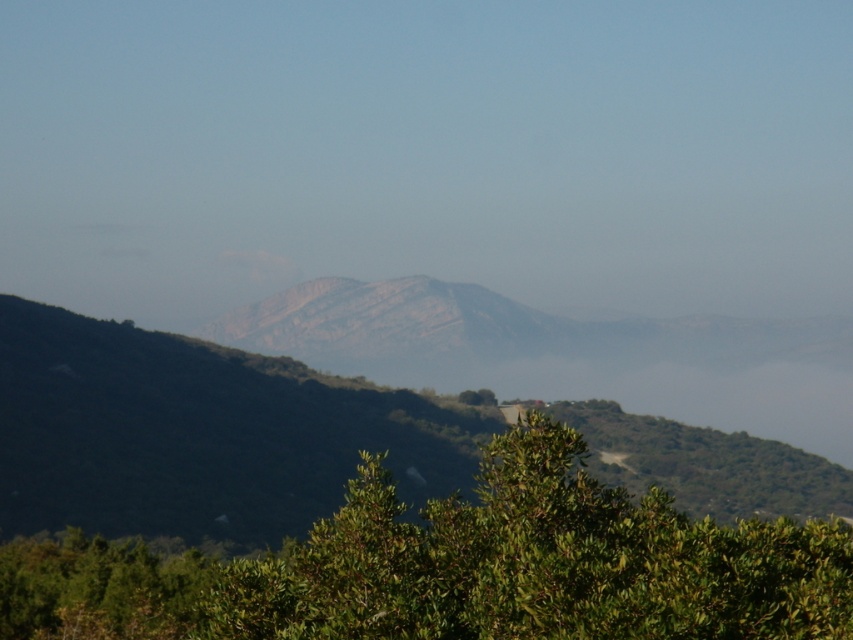
You are standing at the point with coordinates point (360, 632) and want to walk towards the point with coordinates point (132, 506). Given the landscape described, will you have to climb uphill or downhill to reach your destination?

Since point (360, 632) is in front of point (132, 506), it means you are already closer to the foreground. To reach the point behind it, you would need to move towards the background, which in the scene is elevated with hills and mountains. Therefore, you would have to climb uphill to reach point (132, 506).

You are an outdoor photographer planning to capture a landscape shot that includes both the green leafy tree at center and the rugged stone mountain at center. Based on their relative sizes, which object should you position closer to the center of your frame to ensure both are adequately framed without one overpowering the other?

The green leafy tree at center has a lesser width compared to the rugged stone mountain at center. To balance the composition, position the green leafy tree at center slightly closer to the center of the frame since it is smaller, allowing the larger rugged stone mountain at center to occupy more space while maintaining visual harmony.

You are an artist planning to paint the landscape. You want to ensure the green leafy tree at center and rugged stone mountain at center are proportionate to their actual sizes. Which object should you draw larger in your painting?

The rugged stone mountain at center should be drawn larger than the green leafy tree at center because it is stated to be larger in the scene.